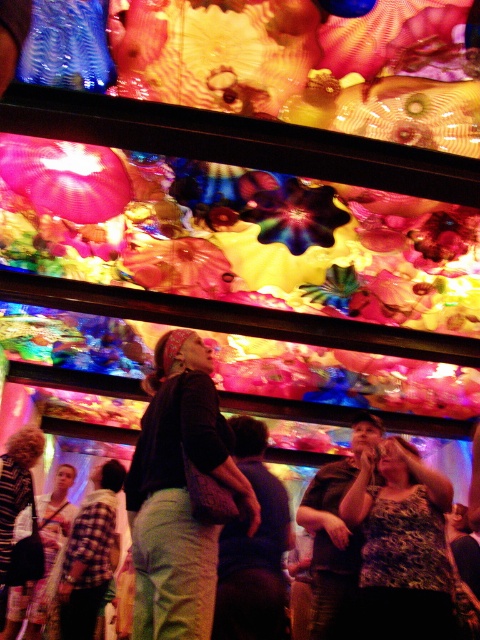
Question: Which point is farther from the camera taking this photo?

Choices:
 (A) (363, 518)
 (B) (145, 480)

Answer: (A)

Question: Which point is closer to the camera?

Choices:
 (A) (205, 403)
 (B) (372, 476)

Answer: (A)

Question: Is the position of matte black shirt at center more distant than that of leopard print tank top at center?

Choices:
 (A) no
 (B) yes

Answer: (A)

Question: Can you confirm if matte black shirt at center is thinner than leopard print tank top at center?

Choices:
 (A) no
 (B) yes

Answer: (A)

Question: Which point is farther to the camera?

Choices:
 (A) matte black shirt at center
 (B) leopard print tank top at center

Answer: (B)

Question: Is matte black shirt at center above leopard print tank top at center?

Choices:
 (A) no
 (B) yes

Answer: (B)